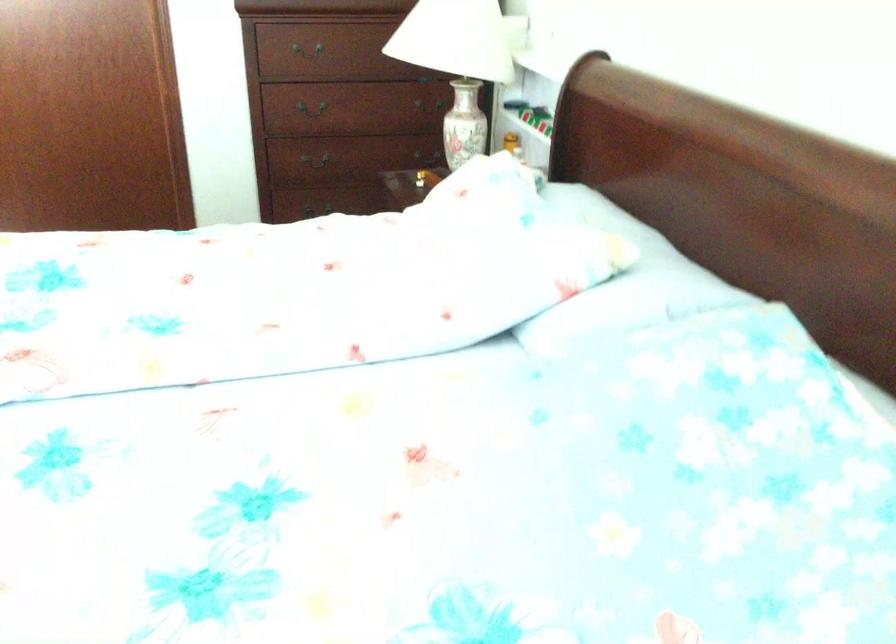
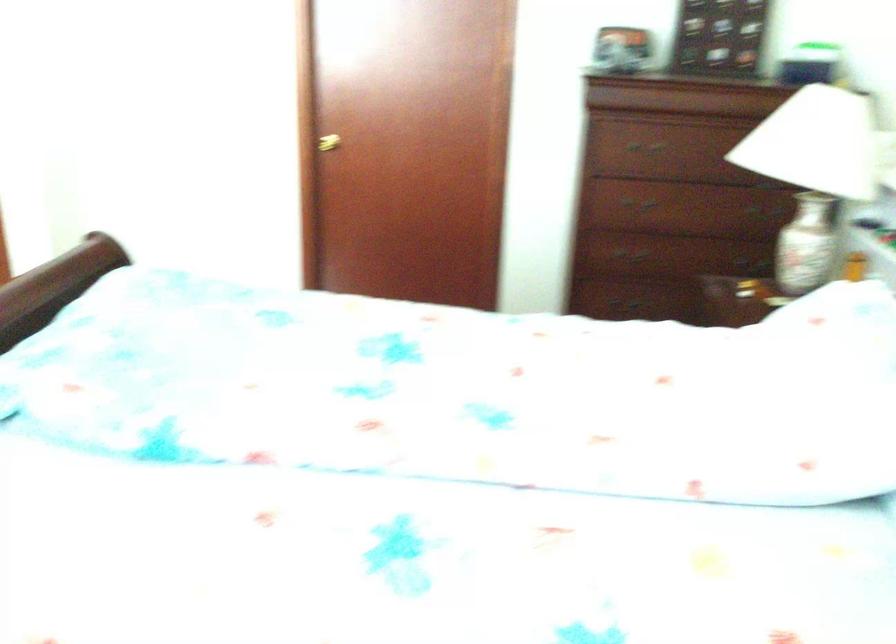
What movement of the cameraman would produce the second image?

The movement direction of the cameraman is left, forward.